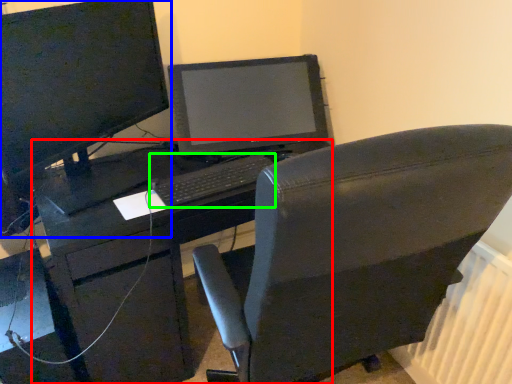
Question: Considering the real-world distances, which object is farthest from desk (highlighted by a red box)? computer monitor (highlighted by a blue box) or computer keyboard (highlighted by a green box)?

Choices:
 (A) computer monitor
 (B) computer keyboard

Answer: (A)